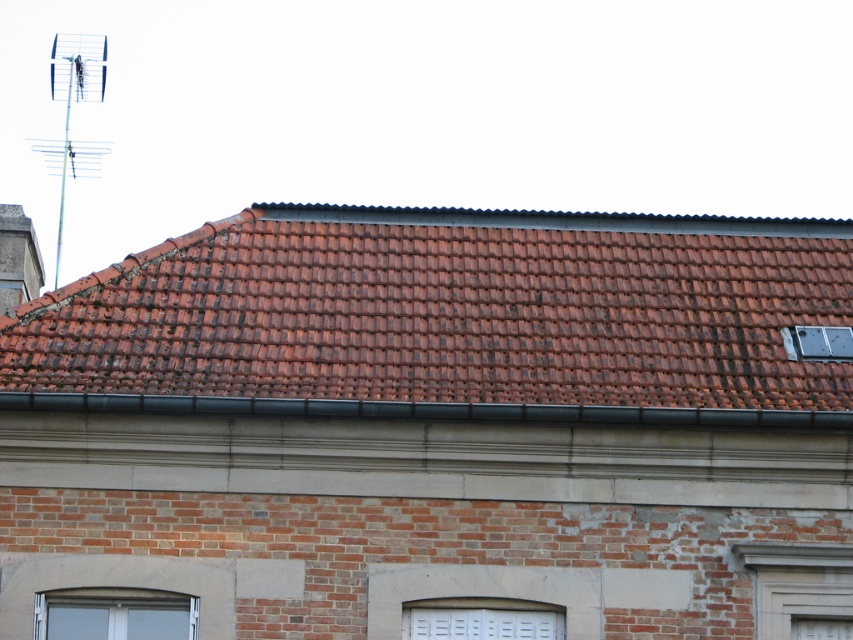
Question: Which object is positioned farthest from the matte glass window at lower left?

Choices:
 (A) brown clay tiles at upper center
 (B) white painted wood window at lower center

Answer: (A)

Question: Estimate the real-world distances between objects in this image. Which object is closer to the white painted wood window at lower center?

Choices:
 (A) brown clay tiles at upper center
 (B) matte glass window at lower left

Answer: (B)

Question: Which of the following is the closest to the observer?

Choices:
 (A) (140, 632)
 (B) (477, 609)

Answer: (A)

Question: Is brown clay tiles at upper center positioned in front of white painted wood window at lower center?

Choices:
 (A) no
 (B) yes

Answer: (B)

Question: Can you confirm if brown clay tiles at upper center is positioned below white painted wood window at lower center?

Choices:
 (A) yes
 (B) no

Answer: (B)

Question: Does matte glass window at lower left appear on the right side of white painted wood window at lower center?

Choices:
 (A) yes
 (B) no

Answer: (B)